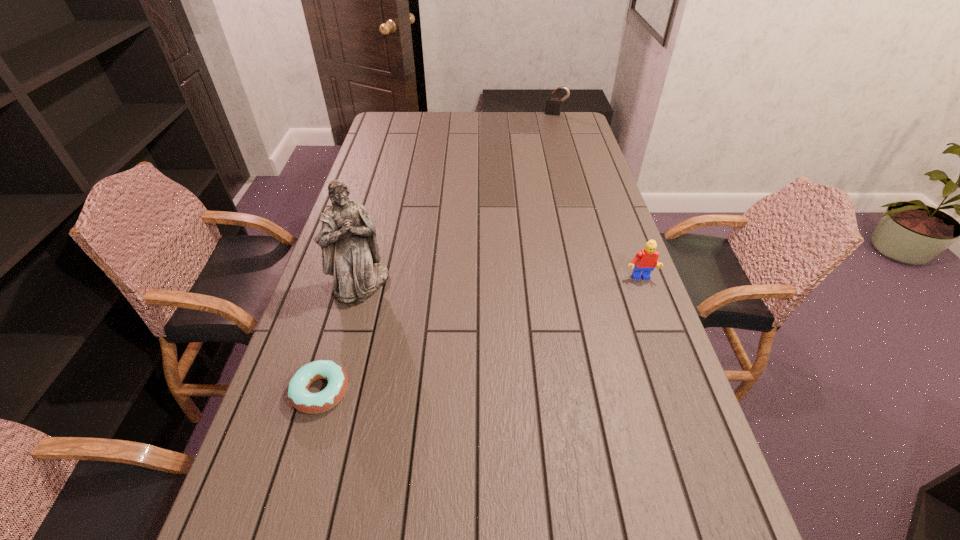
Where is `doughnut`? doughnut is located at coordinates (299, 396).

Where is `the shortest object`? The image size is (960, 540). the shortest object is located at coordinates pyautogui.click(x=299, y=396).

At what (x,y) coordinates should I click in order to perform the action: click on the rightmost object. Please return your answer as a coordinate pair (x, y). This screenshot has width=960, height=540. Looking at the image, I should click on (645, 261).

Locate an element on the screen. The height and width of the screenshot is (540, 960). padlock is located at coordinates (553, 105).

Where is `the farthest object`? The width and height of the screenshot is (960, 540). the farthest object is located at coordinates (553, 105).

Locate an element on the screen. The image size is (960, 540). figurine is located at coordinates (350, 253).

Image resolution: width=960 pixels, height=540 pixels. What are the coordinates of `vacant area situated on the front of the doughnut` in the screenshot? It's located at (306, 440).

Where is `vacant space located on the front-facing side of the Lego`? This screenshot has width=960, height=540. vacant space located on the front-facing side of the Lego is located at coordinates (650, 307).

Find the location of a particular element. free space located with the keyhole on the front of the farthest object is located at coordinates (549, 129).

Identify the location of free space located 0.070m with the keyhole on the front of the farthest object. (551, 122).